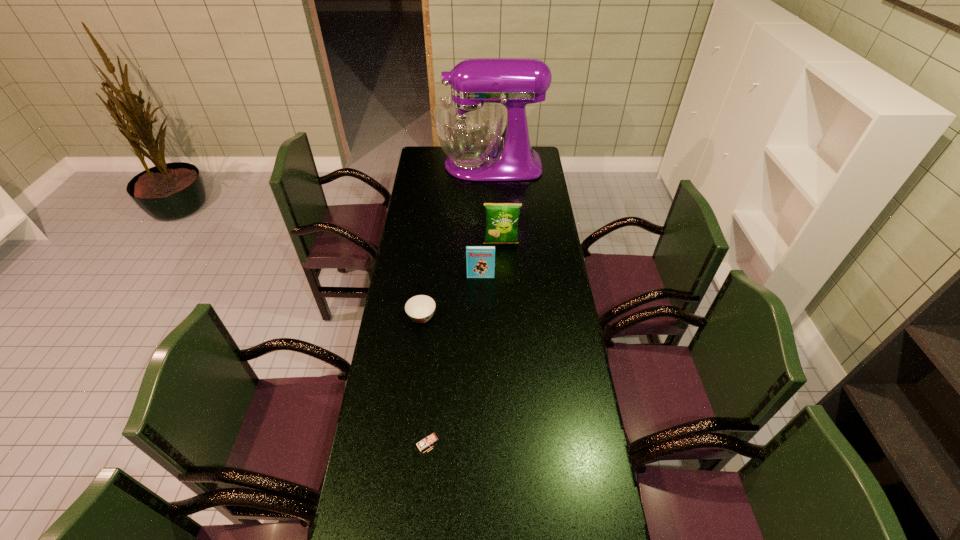
Locate an element on the screen. The width and height of the screenshot is (960, 540). mixer is located at coordinates (469, 124).

At what (x,y) coordinates should I click in order to perform the action: click on the tallest object. Please return your answer as a coordinate pair (x, y). Looking at the image, I should click on (469, 124).

At what (x,y) coordinates should I click in order to perform the action: click on crisp (potato chip). Please return your answer as a coordinate pair (x, y). Looking at the image, I should click on (502, 219).

Locate an element on the screen. the second tallest object is located at coordinates (502, 219).

Where is `the third farthest object`? This screenshot has width=960, height=540. the third farthest object is located at coordinates (480, 260).

Identify the location of book. (480, 260).

Identify the location of the nearest object. (427, 440).

Image resolution: width=960 pixels, height=540 pixels. What are the coordinates of `the fourth tallest object` in the screenshot? It's located at (427, 440).

Find the location of a particular element. This screenshot has height=540, width=960. the shortest object is located at coordinates click(x=420, y=308).

The width and height of the screenshot is (960, 540). Identify the location of the fourth farthest object. (420, 308).